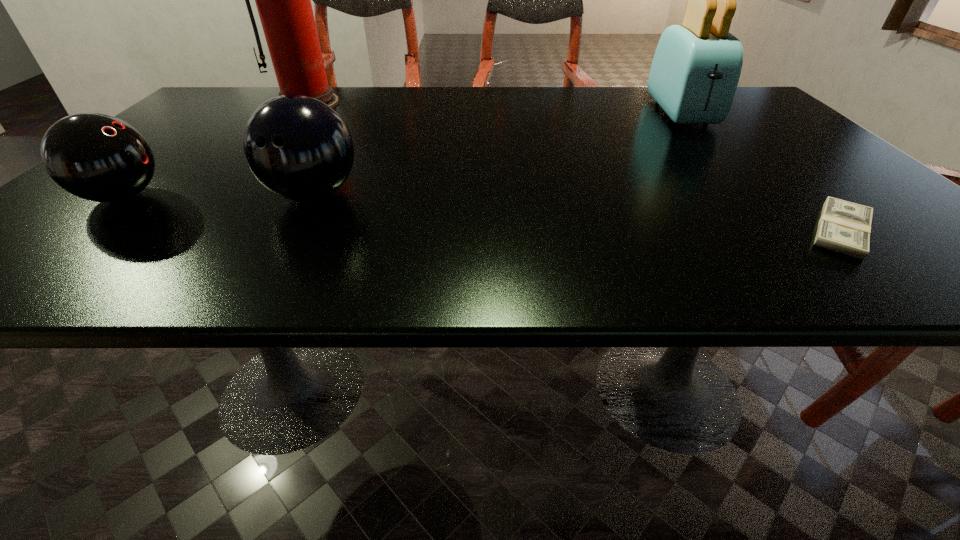
Find the location of a particular element. The width and height of the screenshot is (960, 540). free point located on the back of the shortest object is located at coordinates (724, 120).

Where is `fire extinguisher present at the far edge`? The image size is (960, 540). fire extinguisher present at the far edge is located at coordinates pyautogui.click(x=283, y=0).

You are a GUI agent. You are given a task and a screenshot of the screen. Output one action in this format:
    pyautogui.click(x=<x>, y=<y>)
    Task: Click on the toaster located at the far edge
    This screenshot has width=960, height=540.
    Given the screenshot: What is the action you would take?
    pyautogui.click(x=696, y=68)

Find the location of a particular element. Image resolution: width=960 pixels, height=540 pixels. object that is at the near edge is located at coordinates (844, 227).

Where is `object that is positioned at the left edge`? The height and width of the screenshot is (540, 960). object that is positioned at the left edge is located at coordinates (97, 157).

Where is `toaster located in the right edge section of the desktop`? The height and width of the screenshot is (540, 960). toaster located in the right edge section of the desktop is located at coordinates (696, 68).

Locate an element on the screen. dollar that is positioned at the right edge is located at coordinates (844, 227).

Find the location of a particular element. Image resolution: width=960 pixels, height=540 pixels. object that is at the far right corner is located at coordinates (696, 68).

I want to click on object located at the near right corner, so click(844, 227).

This screenshot has width=960, height=540. I want to click on free space at the far edge of the desktop, so click(x=396, y=93).